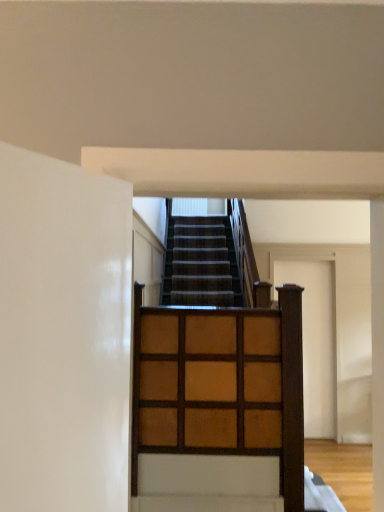
Question: Is wooden door at center to the left or to the right of wooden grid at center in the image?

Choices:
 (A) right
 (B) left

Answer: (A)

Question: Is wooden door at center bigger or smaller than wooden grid at center?

Choices:
 (A) small
 (B) big

Answer: (B)

Question: Is wooden door at center spatially inside wooden grid at center, or outside of it?

Choices:
 (A) inside
 (B) outside

Answer: (B)

Question: Considering the positions of point (291, 329) and point (314, 331), is point (291, 329) closer or farther from the camera than point (314, 331)?

Choices:
 (A) farther
 (B) closer

Answer: (B)

Question: Is wooden grid at center to the left or to the right of wooden door at center in the image?

Choices:
 (A) left
 (B) right

Answer: (A)

Question: From the image's perspective, relative to wooden door at center, is wooden grid at center above or below?

Choices:
 (A) above
 (B) below

Answer: (A)

Question: In terms of height, does wooden grid at center look taller or shorter compared to wooden door at center?

Choices:
 (A) tall
 (B) short

Answer: (B)